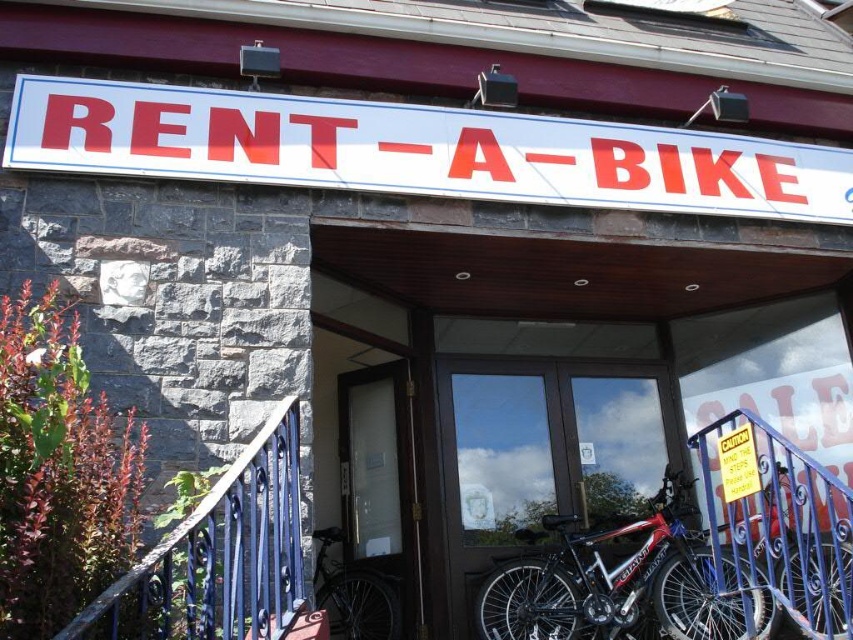
You are standing at the entrance of the RENT_A_BIKE building and want to know how far the point marked at coordinates (x=384, y=472) is from your current position. Can you determine the distance?

The point marked at coordinates (x=384, y=472) is 16.51 feet away from the viewer.

You are standing in front of the RENT_A_BIKE building and need to locate the entrance. Based on the scene description, where is the transparent glass door at center located?

The transparent glass door at center is located at point 0.753 on the x axis and 0.447 on the y axis.